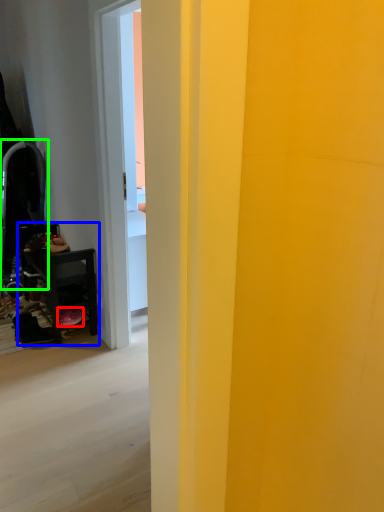
Question: Which object is positioned closest to footwear (highlighted by a red box)? Select from furniture (highlighted by a blue box) and swivel chair (highlighted by a green box).

Choices:
 (A) furniture
 (B) swivel chair

Answer: (A)